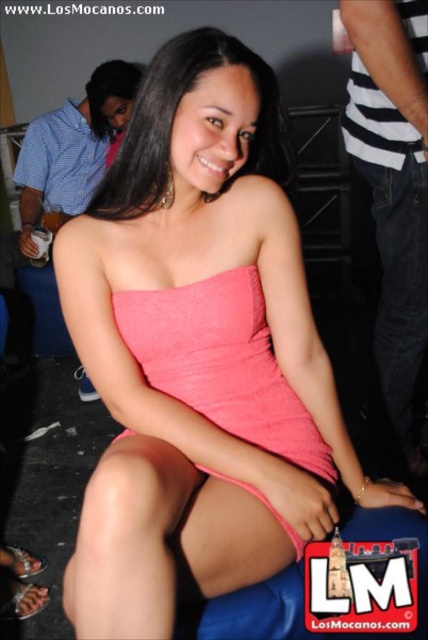
Question: Is denim shorts at right closer to the viewer compared to pink fabric dress at center?

Choices:
 (A) no
 (B) yes

Answer: (A)

Question: Which of the following is the farthest from the observer?

Choices:
 (A) (406, 60)
 (B) (318, 477)

Answer: (A)

Question: Which of the following is the closest to the observer?

Choices:
 (A) pink fabric dress at center
 (B) denim shorts at right

Answer: (A)

Question: Considering the relative positions of denim shorts at right and pink fabric dress at center in the image provided, where is denim shorts at right located with respect to pink fabric dress at center?

Choices:
 (A) below
 (B) above

Answer: (B)

Question: Does denim shorts at right have a lesser width compared to pink fabric dress at center?

Choices:
 (A) no
 (B) yes

Answer: (A)